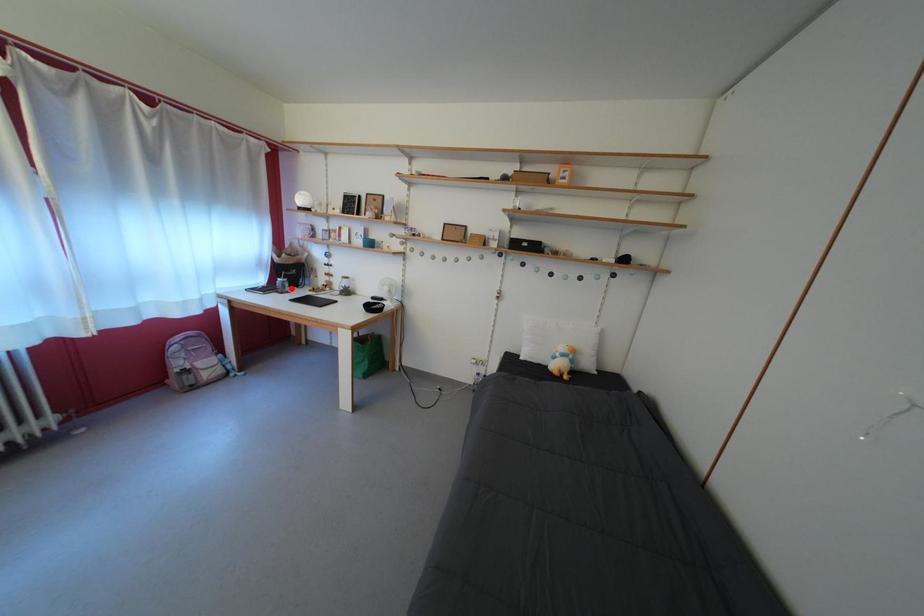
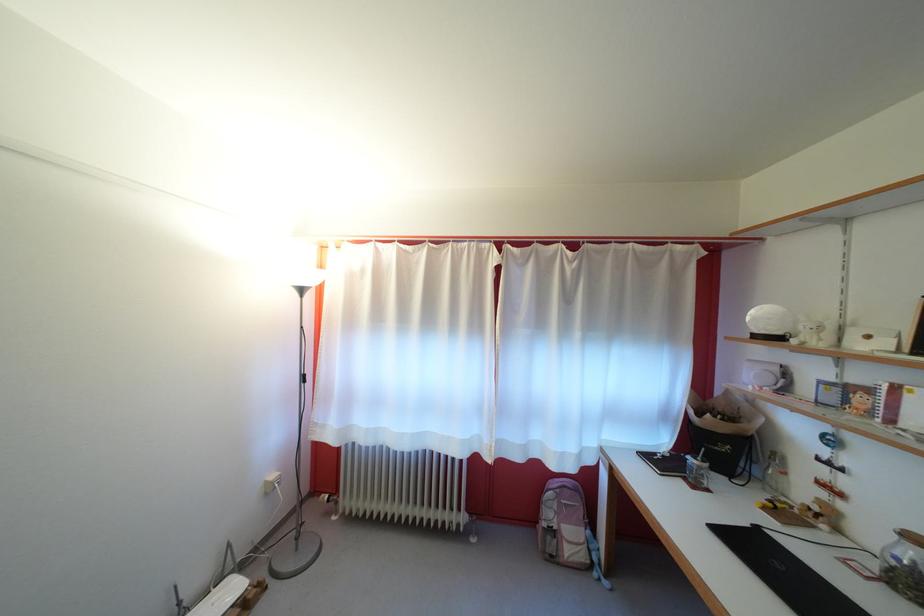
The point at the highlighted location is marked in the first image. Where is the corresponding point in the second image?

(708, 474)